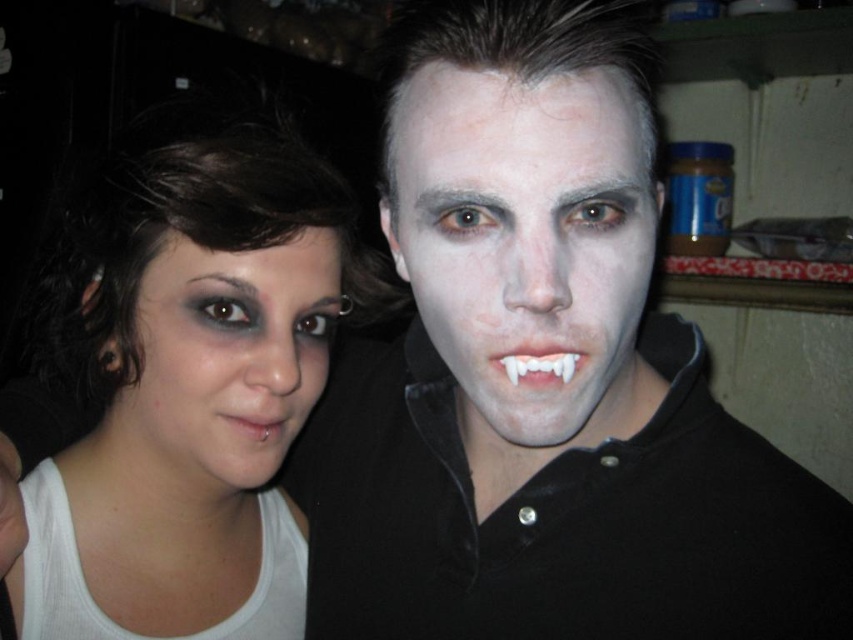
Looking at this image, you are a photographer setting up a portrait session in a dimly lit kitchen. You need to position two props exactly where the white matte face at center and white plastic teeth at center are currently located. Which prop should you place on the left side of the setup?

The white matte face at center should be placed on the left side because it is to the left of the white plastic teeth at center according to the description.

You are a makeup artist preparing to apply a new design on the white matte skin at center and the matte black eye makeup at center. Which area requires more space to work on?

The white matte skin at center requires more space to work on because its width is larger than the matte black eye makeup at center.

You are standing in a dimly lit kitchen and see two points marked on the wall. The first point is at coordinate point(271, 140) and the second is at point(264, 451). If you want to reach the point that is further away from you, which coordinate should you aim for?

Point(271, 140) is behind point(264, 451), so you should aim for point(271, 140) as it is further away from you.